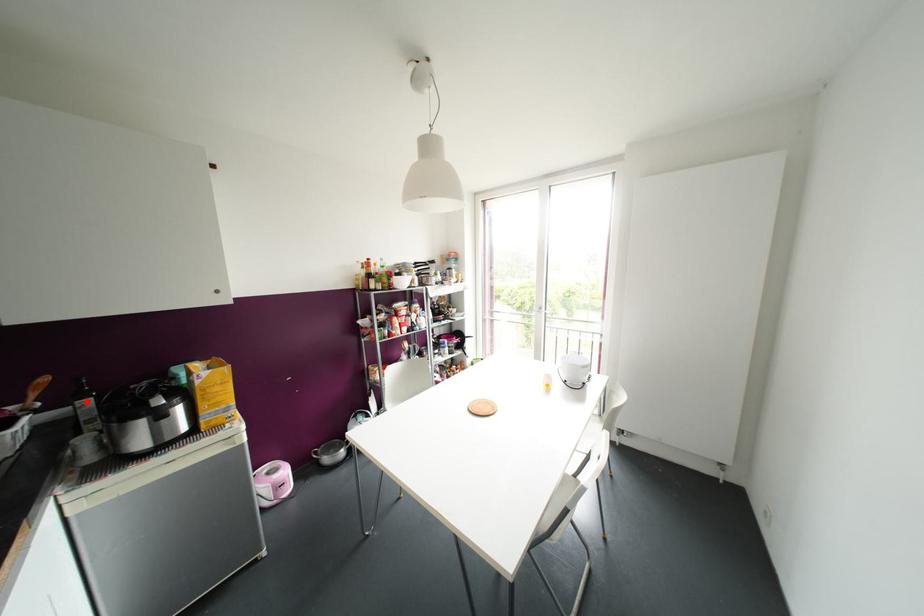
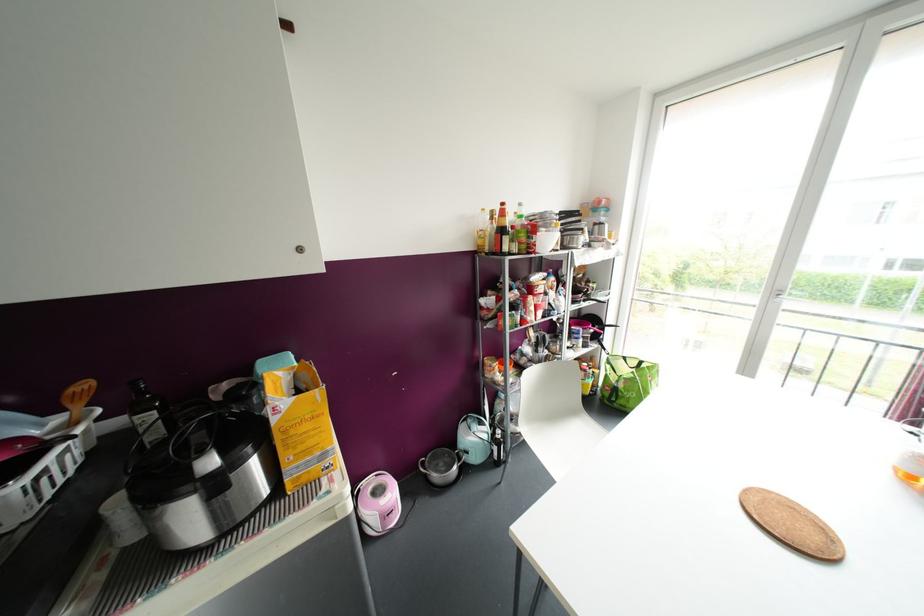
In the second image, find the point that corresponds to the highlighted location in the first image.

(150, 416)